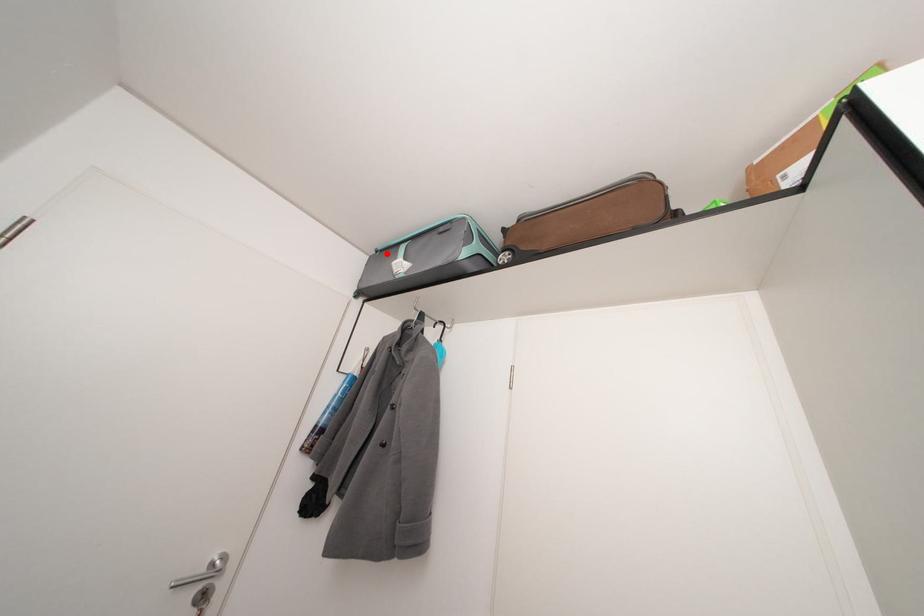
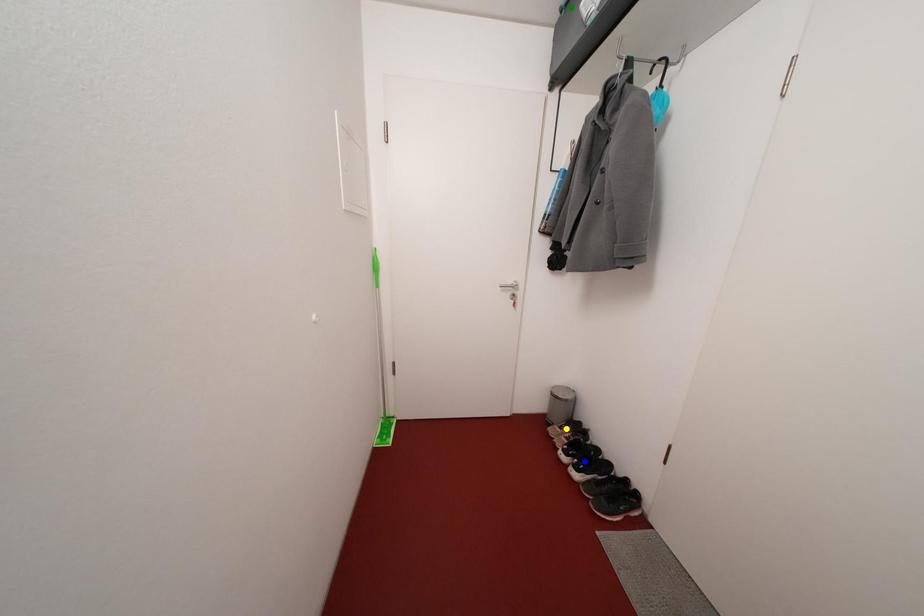
Question: I am providing you with two images of the same scene from different viewpoints. A red point is marked on the first image. You are given multiple points on the second image. Can you choose the point in image 2 that corresponds to the point in image 1?

Choices:
 (A) green point
 (B) blue point
 (C) yellow point

Answer: (A)